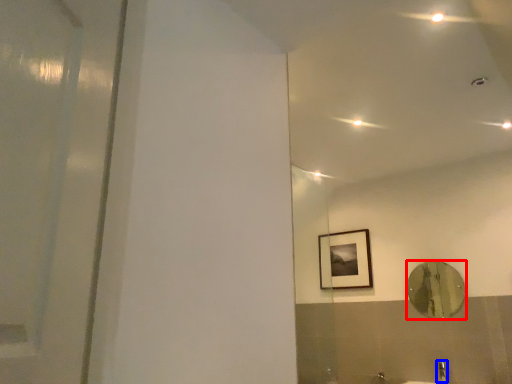
Question: Among these objects, which one is nearest to the camera, mirror (highlighted by a red box) or faucet (highlighted by a blue box)?

Choices:
 (A) mirror
 (B) faucet

Answer: (B)